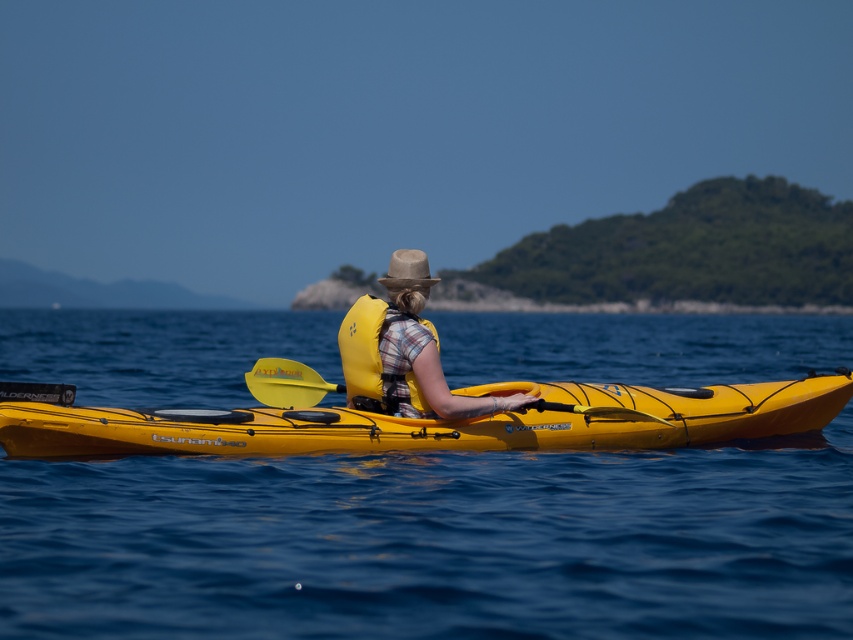
You are standing on the shore and see two points in the water. The first point is at coordinate point (412, 612) and the second point is at coordinate point (4, 392). Which point is closer to you?

Point (412, 612) is closer to you than point (4, 392).

You are a drone operator trying to capture the kayaker in the image. The drone is currently at point (x=434, y=544). The kayaker is in the bright yellow kayak at lower center. Can you see the kayaker from your current position?

The point (x=434, y=544) is on transparent blue water at center, so the drone is over the water. The kayaker is in the bright yellow kayak at lower center, which is likely below the drone. Therefore, the drone operator can see the kayaker from that position.

You are a photographer trying to capture the reflection of the gray felt cowboy hat at center in the transparent blue water at center. Based on the scene description, can you confirm if the hat is positioned in a way that its reflection would be visible in the water?

The transparent blue water at center is in front of the gray felt cowboy hat at center, which means the hat is positioned behind the water. Since reflections require the object to be above the reflective surface, the gray felt cowboy hat at center would need to be above the transparent blue water at center for its reflection to appear. However, the description states the water is in front of the hat, implying the hat is behind the water and thus its reflection would not be visible in the water.